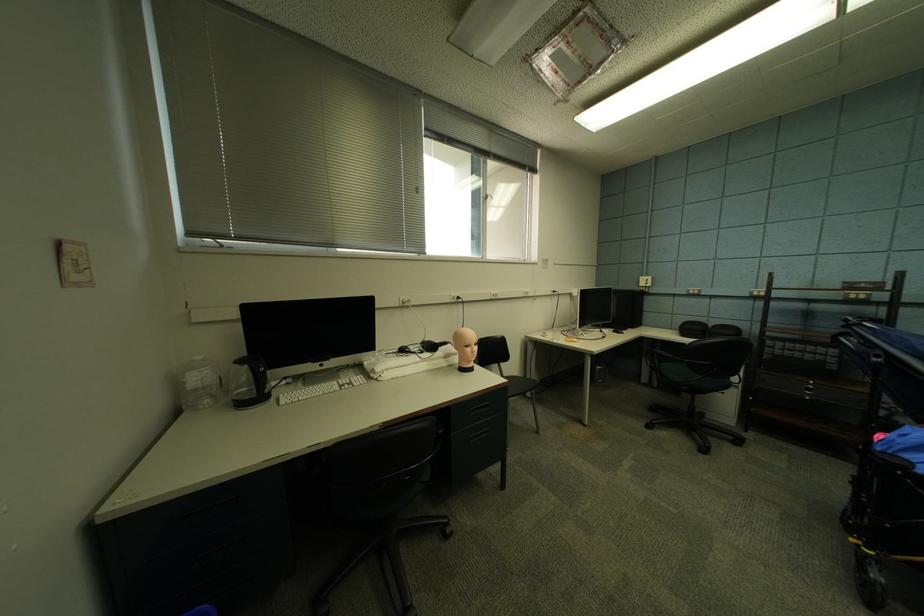
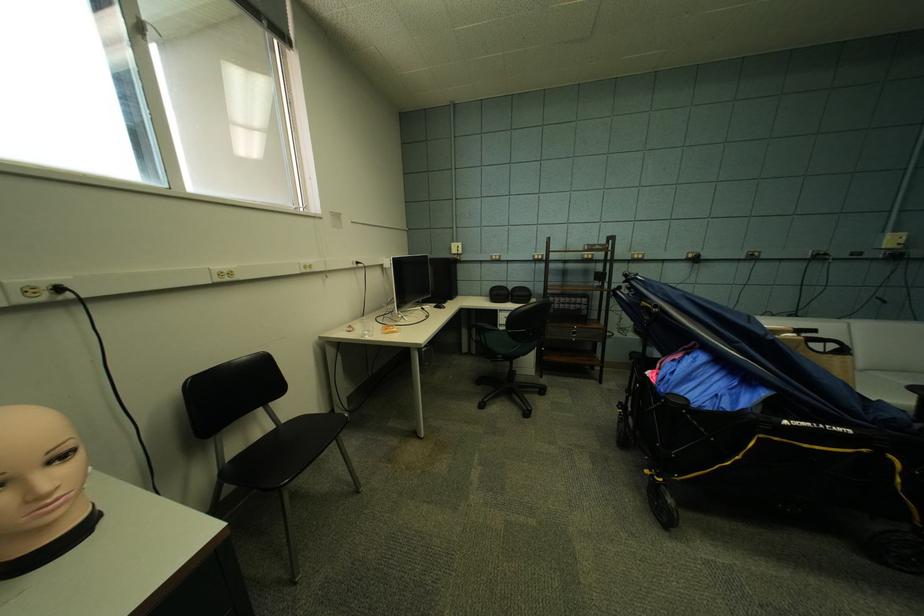
Locate, in the second image, the point that corresponds to the point at 554,337 in the first image.

(361, 331)